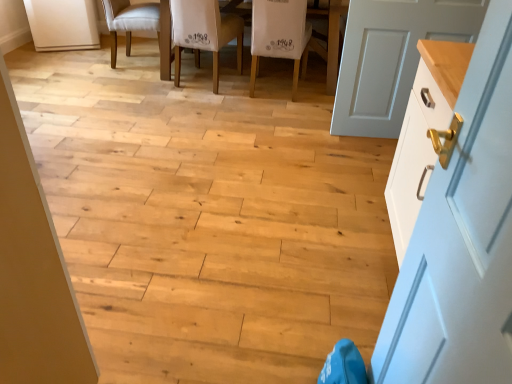
This screenshot has height=384, width=512. I want to click on vacant area in front of wooden table at center, so click(x=222, y=139).